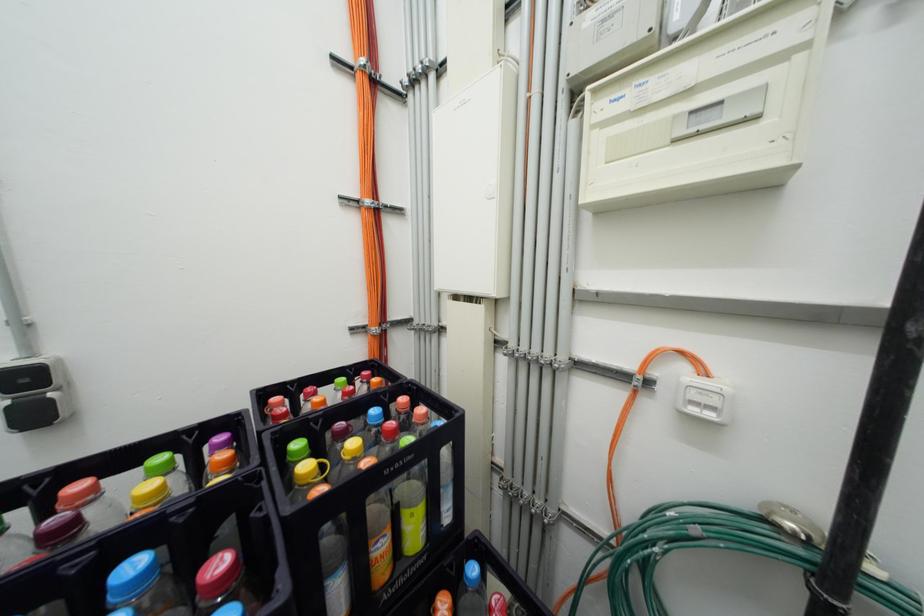
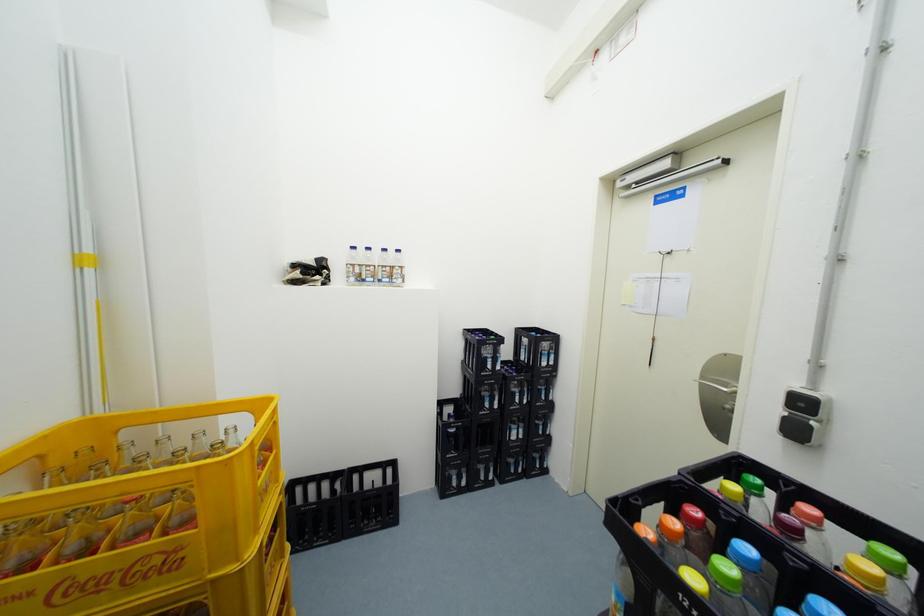
Question: How did the camera likely rotate?

Choices:
 (A) Left
 (B) Right
 (C) Up
 (D) Down

Answer: (A)